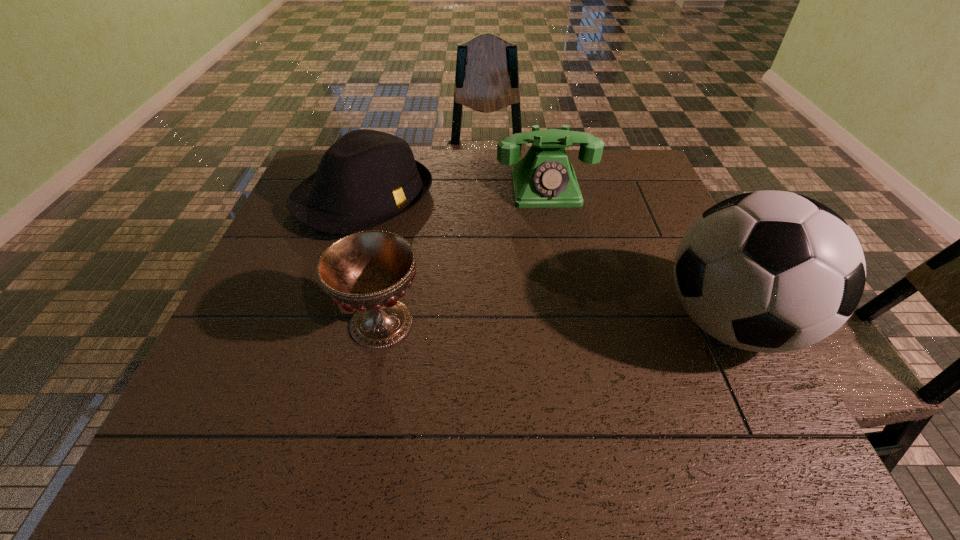
I want to click on vacant space located 0.070m on the front-facing side of the fedora, so click(430, 238).

You are a GUI agent. You are given a task and a screenshot of the screen. Output one action in this format:
    pyautogui.click(x=<x>, y=<y>)
    Task: Click on the free space located 0.250m on the front-facing side of the fedora
    
    Given the screenshot: What is the action you would take?
    pyautogui.click(x=485, y=269)

Identify the location of free space located on the front-facing side of the fedora. (485, 269).

The width and height of the screenshot is (960, 540). I want to click on telephone that is positioned at the far edge, so tap(544, 178).

Locate an element on the screen. This screenshot has height=540, width=960. fedora located in the far edge section of the desktop is located at coordinates (366, 178).

What are the coordinates of `object that is positioned at the near edge` in the screenshot? It's located at (768, 271).

Find the location of a particular element. object located in the left edge section of the desktop is located at coordinates (366, 178).

Locate an element on the screen. This screenshot has width=960, height=540. object that is at the right edge is located at coordinates (768, 271).

Find the location of a particular element. The width and height of the screenshot is (960, 540). object that is at the far left corner is located at coordinates (366, 178).

Find the location of a particular element. object located at the near right corner is located at coordinates (768, 271).